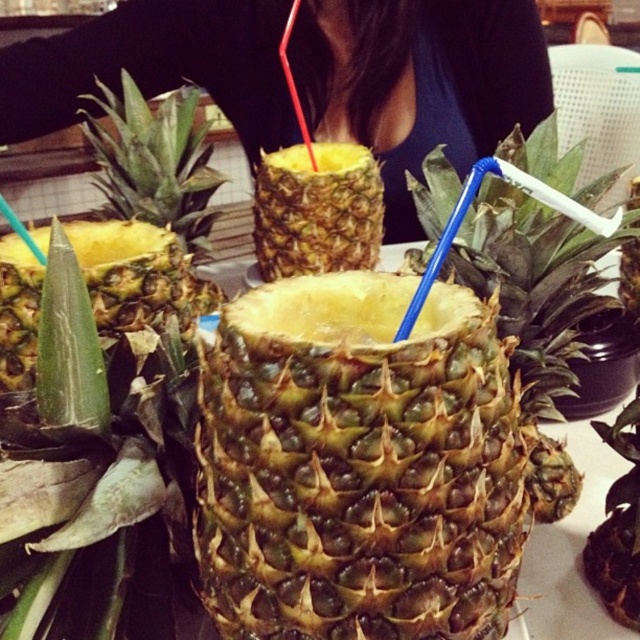
Question: Does green textured pineapple at center have a lesser width compared to black fabric at center?

Choices:
 (A) yes
 (B) no

Answer: (A)

Question: Which object appears farthest from the camera in this image?

Choices:
 (A) green rough pineapple at center
 (B) green textured pineapple at center
 (C) black fabric at center

Answer: (C)

Question: Which object is farther from the camera taking this photo?

Choices:
 (A) black fabric at center
 (B) green rough pineapple at center
 (C) green textured pineapple at center

Answer: (A)

Question: Does green textured pineapple at center have a greater width compared to black fabric at center?

Choices:
 (A) yes
 (B) no

Answer: (B)

Question: Can you confirm if green textured pineapple at center is positioned above black fabric at center?

Choices:
 (A) no
 (B) yes

Answer: (A)

Question: Which point appears closest to the camera in this image?

Choices:
 (A) (449, 420)
 (B) (385, 182)
 (C) (324, 168)

Answer: (A)